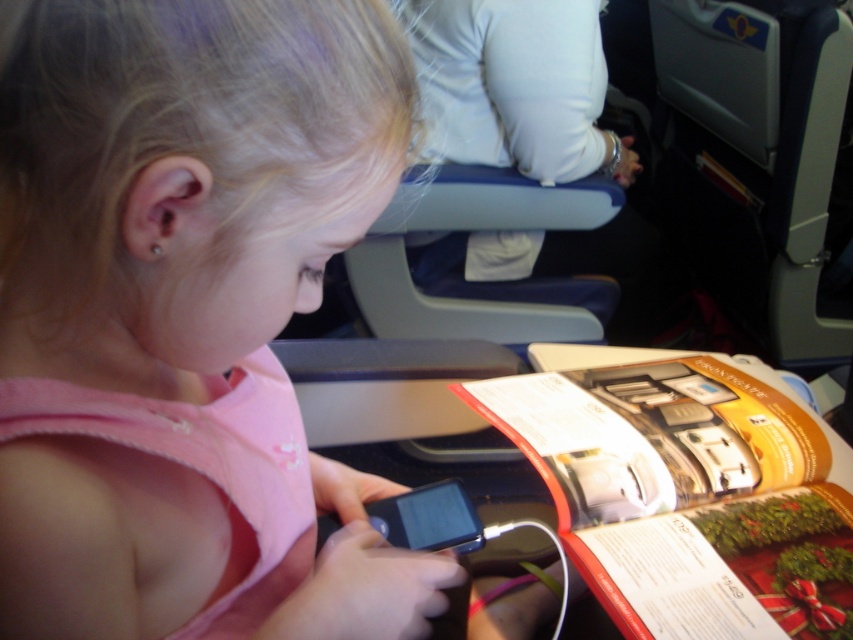
Question: Is pink fabric girl at center above orange glossy magazine at lower right?

Choices:
 (A) yes
 (B) no

Answer: (B)

Question: Is pink fabric girl at center smaller than orange glossy magazine at lower right?

Choices:
 (A) yes
 (B) no

Answer: (B)

Question: Among these objects, which one is nearest to the camera?

Choices:
 (A) orange glossy magazine at lower right
 (B) pink fabric girl at center

Answer: (B)

Question: In this image, where is pink fabric girl at center located relative to orange glossy magazine at lower right?

Choices:
 (A) below
 (B) above

Answer: (A)

Question: Which point is closer to the camera?

Choices:
 (A) orange glossy magazine at lower right
 (B) pink fabric girl at center

Answer: (B)

Question: Which point is closer to the camera taking this photo?

Choices:
 (A) (67, 620)
 (B) (648, 392)

Answer: (A)